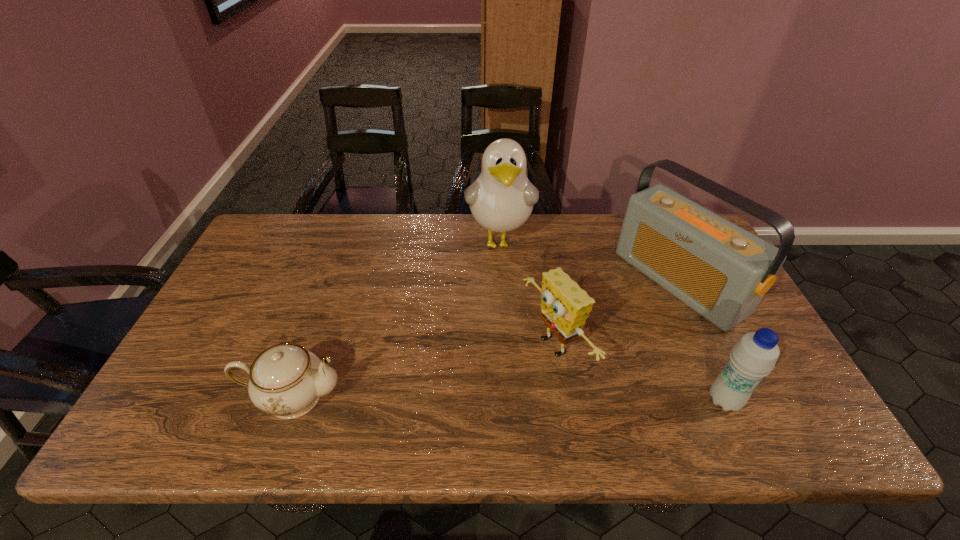
Image resolution: width=960 pixels, height=540 pixels. I want to click on free space located 0.090m on the front-facing side of the radio receiver, so click(620, 323).

Identify the location of vacant space situated on the face of the sponge. Image resolution: width=960 pixels, height=540 pixels. (512, 376).

Where is `vacant region located 0.170m on the beak of the gull`? This screenshot has height=540, width=960. vacant region located 0.170m on the beak of the gull is located at coordinates (501, 310).

You are a GUI agent. You are given a task and a screenshot of the screen. Output one action in this format:
    pyautogui.click(x=<x>, y=<y>)
    Task: Click on the vacant point located on the beak of the gull
    This screenshot has width=960, height=540.
    Given the screenshot: What is the action you would take?
    pyautogui.click(x=503, y=354)

I want to click on vacant area located 0.390m on the beak of the gull, so click(x=503, y=378).

At what (x,y) coordinates should I click in order to perform the action: click on radio receiver that is at the far edge. Please return your answer as a coordinate pair (x, y). Looking at the image, I should click on (720, 270).

This screenshot has height=540, width=960. Identify the location of gull at the far edge. (501, 199).

You are a GUI agent. You are given a task and a screenshot of the screen. Output one action in this format:
    pyautogui.click(x=<x>, y=<y>)
    Task: Click on the chinaware that is at the near edge
    The width and height of the screenshot is (960, 540).
    Given the screenshot: What is the action you would take?
    pyautogui.click(x=286, y=380)

At what (x,y) coordinates should I click in order to perform the action: click on water bottle positioned at the near edge. Please return your answer as a coordinate pair (x, y). The image size is (960, 540). Looking at the image, I should click on coord(754,356).

The height and width of the screenshot is (540, 960). I want to click on sponge that is at the near edge, so click(x=565, y=306).